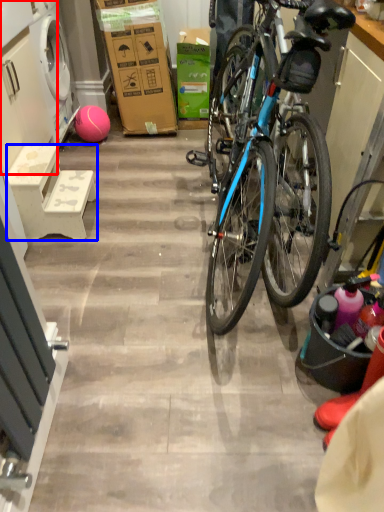
Question: Which object is further to the camera taking this photo, cabinetry (highlighted by a red box) or stool (highlighted by a blue box)?

Choices:
 (A) cabinetry
 (B) stool

Answer: (A)